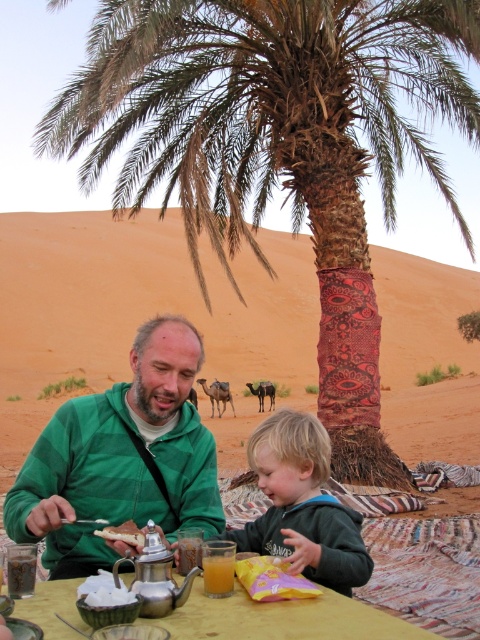
Question: Which point appears closest to the camera in this image?

Choices:
 (A) (255, 109)
 (B) (259, 540)
 (C) (204, 572)

Answer: (C)

Question: Among these objects, which one is nearest to the camera?

Choices:
 (A) green fleece jacket at center
 (B) green fleece jacket at lower center

Answer: (B)

Question: Is brown textured palm tree at center smaller than green fleece jacket at lower center?

Choices:
 (A) yes
 (B) no

Answer: (B)

Question: Can you confirm if green fleece jacket at lower center is positioned to the left of wooden table at center?

Choices:
 (A) yes
 (B) no

Answer: (B)

Question: Can you confirm if green fleece jacket at center is smaller than green fleece jacket at lower center?

Choices:
 (A) no
 (B) yes

Answer: (A)

Question: Which object is the closest to the white bread at center?

Choices:
 (A) translucent glass juice at lower center
 (B) green fleece jacket at center
 (C) green fleece jacket at lower center
 (D) brown textured palm tree at center

Answer: (A)